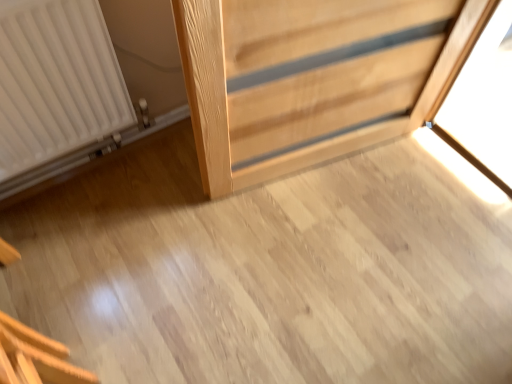
Identify the location of white textured radiator at lower left. (56, 89).

This screenshot has height=384, width=512. Describe the element at coordinates (56, 89) in the screenshot. I see `white textured radiator at lower left` at that location.

The height and width of the screenshot is (384, 512). I want to click on white textured radiator at lower left, so click(56, 89).